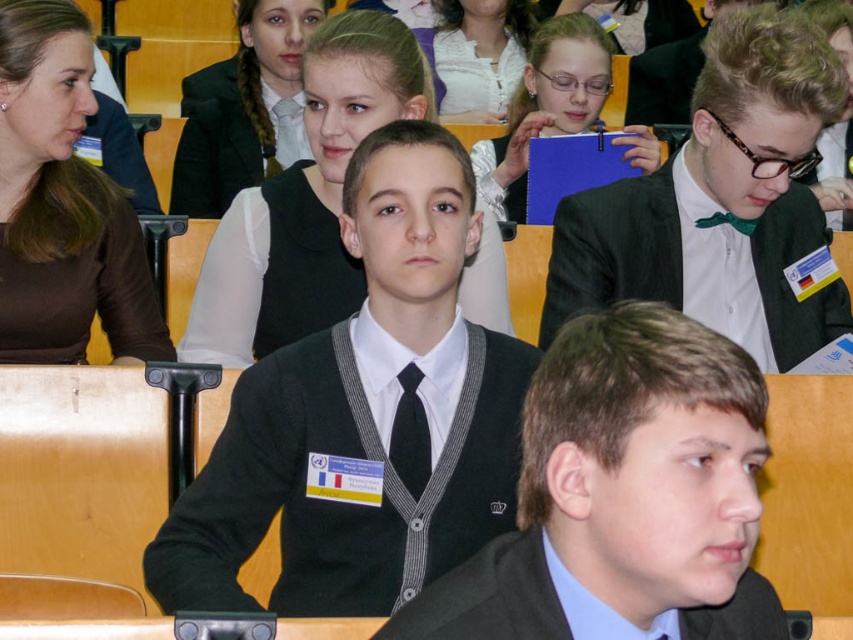
Question: Can you confirm if matte black sweater at center is positioned below green satin bow tie at upper right?

Choices:
 (A) yes
 (B) no

Answer: (A)

Question: Which object is positioned farthest from the black wool sweater at center?

Choices:
 (A) black pinstripe tie at center
 (B) green satin bow tie at upper right

Answer: (B)

Question: Where is black wool sweater at center located in relation to matte black sweater at center in the image?

Choices:
 (A) right
 (B) left

Answer: (B)

Question: Which of the following is the farthest from the observer?

Choices:
 (A) (751, 280)
 (B) (430, 472)

Answer: (A)

Question: Is black wool sweater at center above black pinstripe tie at center?

Choices:
 (A) yes
 (B) no

Answer: (A)

Question: Which object is the farthest from the black wool sweater at center?

Choices:
 (A) matte black sweater at center
 (B) black pinstripe tie at center

Answer: (A)